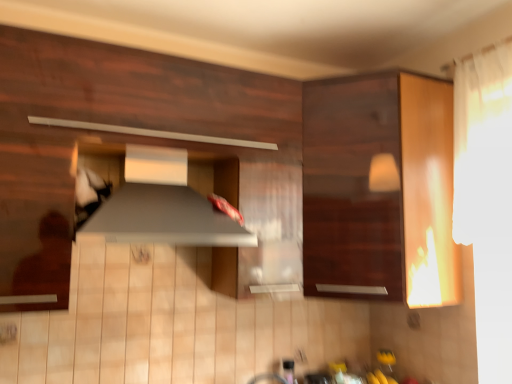
Question: Does point (101, 235) appear closer or farther from the camera than point (313, 279)?

Choices:
 (A) closer
 (B) farther

Answer: (A)

Question: Is satin silver exhaust hood at center taller or shorter than wooden cabinet at right, the 1th cabinetry when ordered from right to left?

Choices:
 (A) tall
 (B) short

Answer: (B)

Question: Which object is positioned closest to the matte wood cabinet at center, marked as the 1th cabinetry in a left-to-right arrangement?

Choices:
 (A) satin silver exhaust hood at center
 (B) wooden cabinet at right, which ranks as the second cabinetry in left-to-right order

Answer: (A)

Question: Which object is positioned closest to the matte wood cabinet at center, marked as the 1th cabinetry in a left-to-right arrangement?

Choices:
 (A) wooden cabinet at right, the 1th cabinetry when ordered from right to left
 (B) satin silver exhaust hood at center

Answer: (B)